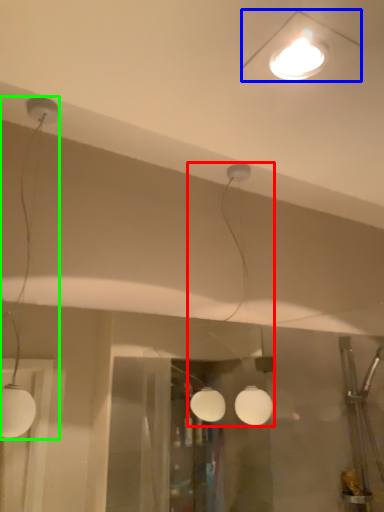
Question: Which is nearer to the lamp (highlighted by a red box)? lamp (highlighted by a blue box) or lamp (highlighted by a green box).

Choices:
 (A) lamp
 (B) lamp

Answer: (A)